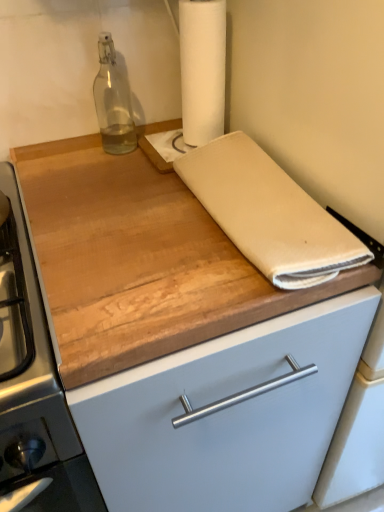
Question: Can you confirm if white paper towel at upper center is wider than beige cotton towel at center?

Choices:
 (A) no
 (B) yes

Answer: (A)

Question: Can you confirm if white paper towel at upper center is smaller than beige cotton towel at center?

Choices:
 (A) yes
 (B) no

Answer: (A)

Question: Is white paper towel at upper center placed right next to beige cotton towel at center?

Choices:
 (A) yes
 (B) no

Answer: (B)

Question: Is white paper towel at upper center surrounding beige cotton towel at center?

Choices:
 (A) yes
 (B) no

Answer: (B)

Question: Does white paper towel at upper center appear on the right side of beige cotton towel at center?

Choices:
 (A) no
 (B) yes

Answer: (A)

Question: Is white paper towel at upper center bigger than beige cotton towel at center?

Choices:
 (A) no
 (B) yes

Answer: (A)

Question: Are wooden cutting board at center and beige cotton towel at center beside each other?

Choices:
 (A) no
 (B) yes

Answer: (A)

Question: From the image's perspective, is wooden cutting board at center above beige cotton towel at center?

Choices:
 (A) yes
 (B) no

Answer: (B)

Question: Is wooden cutting board at center outside of beige cotton towel at center?

Choices:
 (A) yes
 (B) no

Answer: (A)

Question: Is wooden cutting board at center positioned before beige cotton towel at center?

Choices:
 (A) no
 (B) yes

Answer: (B)

Question: Is wooden cutting board at center at the left side of beige cotton towel at center?

Choices:
 (A) no
 (B) yes

Answer: (B)

Question: From a real-world perspective, is wooden cutting board at center physically below beige cotton towel at center?

Choices:
 (A) yes
 (B) no

Answer: (A)

Question: From the image's perspective, is white paper towel at upper center above transparent glass bottle at upper left?

Choices:
 (A) yes
 (B) no

Answer: (A)